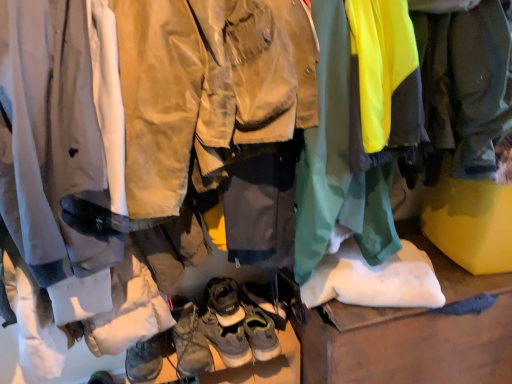
Where is `free space above leather/textured boots at center, which appears as the third footwear when ordered from the bottom (from a real-world perspective)`? free space above leather/textured boots at center, which appears as the third footwear when ordered from the bottom (from a real-world perspective) is located at coordinates (222, 324).